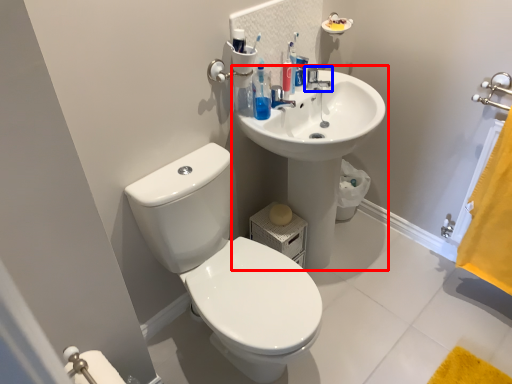
Question: Which of the following is the farthest to the observer, sink (highlighted by a red box) or tap (highlighted by a blue box)?

Choices:
 (A) sink
 (B) tap

Answer: (B)